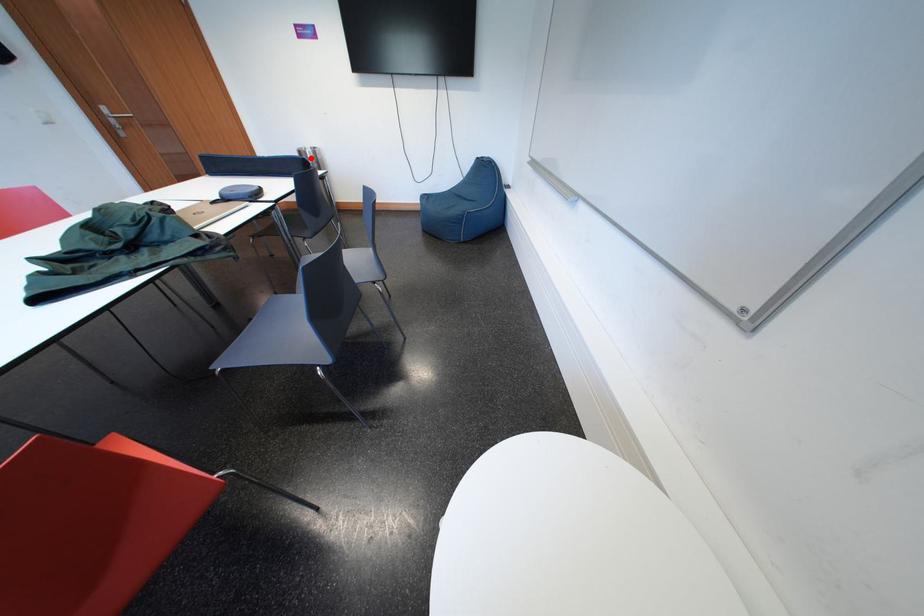
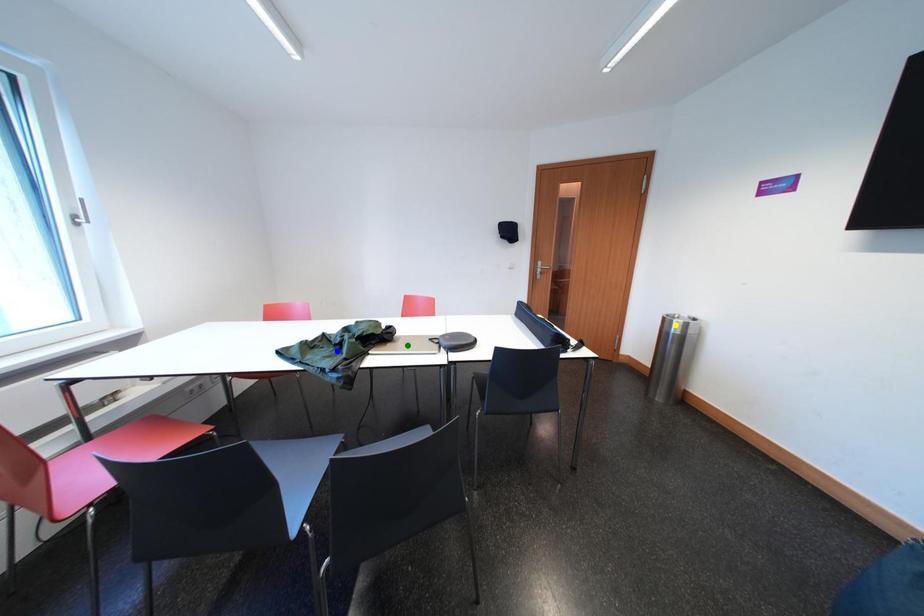
Question: I am providing you with two images of the same scene from different viewpoints. A red point is marked on the first image. You are given multiple points on the second image. Can you choose the point in image 2 that corresponds to the point in image 1?

Choices:
 (A) green point
 (B) yellow point
 (C) blue point

Answer: (B)